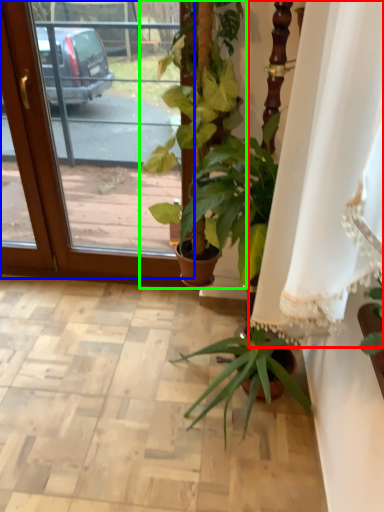
Question: Which object is positioned closest to curtain (highlighted by a red box)? Select from screen door (highlighted by a blue box) and houseplant (highlighted by a green box).

Choices:
 (A) screen door
 (B) houseplant

Answer: (B)